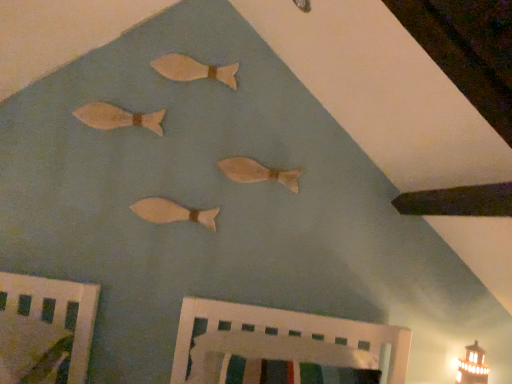
Question: Considering the positions of white painted wood crib at lower center, marked as the 1th furniture in a right-to-left arrangement, and wooden fish at upper left, acting as the third fish starting from the bottom, in the image, is white painted wood crib at lower center, marked as the 1th furniture in a right-to-left arrangement, taller or shorter than wooden fish at upper left, acting as the third fish starting from the bottom,?

Choices:
 (A) tall
 (B) short

Answer: (A)

Question: From the image's perspective, is white painted wood crib at lower center, marked as the 1th furniture in a right-to-left arrangement, located above or below wooden fish at upper left, which appears as the second fish when viewed from the top?

Choices:
 (A) below
 (B) above

Answer: (A)

Question: Which object is positioned closest to the wooden fish at upper center, which appears as the fourth fish when ordered from the bottom?

Choices:
 (A) wooden fish at upper left, which appears as the second fish when viewed from the top
 (B) matte white lighthouse at lower right
 (C) matte wooden fish at center, which ranks as the third fish in top-to-bottom order
 (D) wooden bed frame at lower left, the second furniture when ordered from right to left
 (E) wooden fish at center, which is counted as the 1th fish, starting from the bottom

Answer: (A)

Question: Which of these objects is positioned farthest from the wooden bed frame at lower left, the second furniture when ordered from right to left?

Choices:
 (A) wooden fish at upper left, acting as the third fish starting from the bottom
 (B) wooden fish at upper center, which appears as the fourth fish when ordered from the bottom
 (C) matte wooden fish at center, arranged as the second fish when ordered from the bottom
 (D) wooden fish at center, positioned as the 4th fish in top-to-bottom order
 (E) white painted wood crib at lower center, the second furniture from the left

Answer: (B)